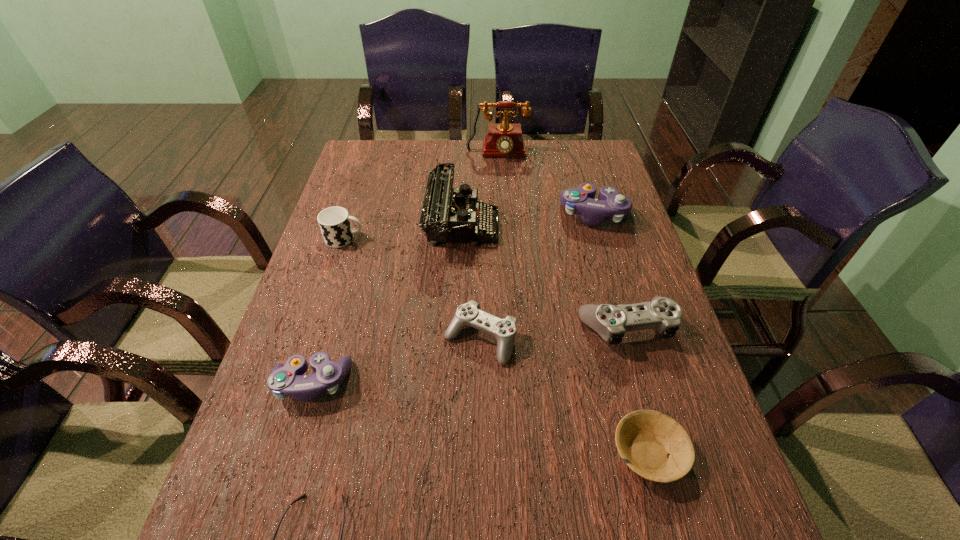
Image resolution: width=960 pixels, height=540 pixels. In order to click on vacant space that satisfies the following two spatial constraints: 1. on the dial of the farthest control; 2. on the left side of the telephone in this screenshot , I will do `click(500, 215)`.